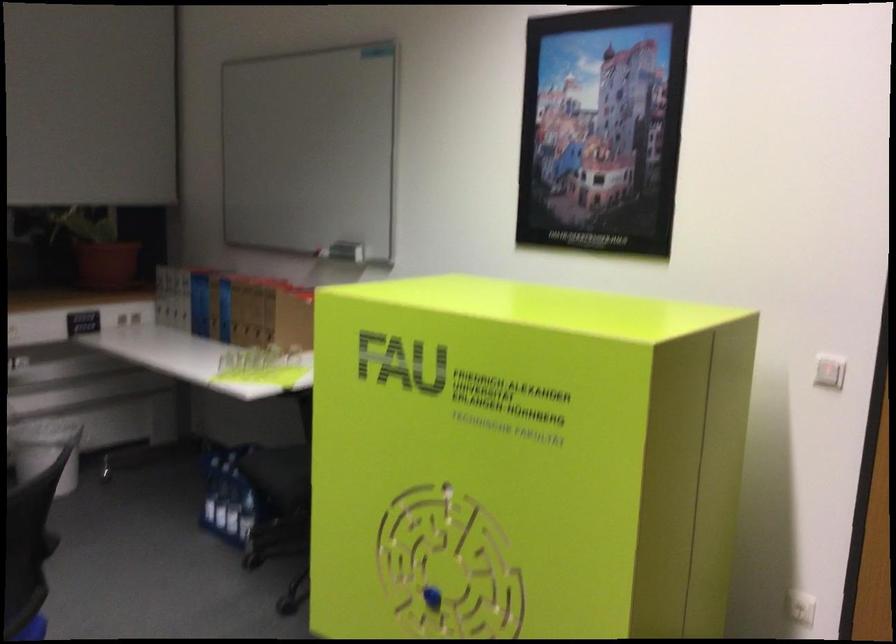
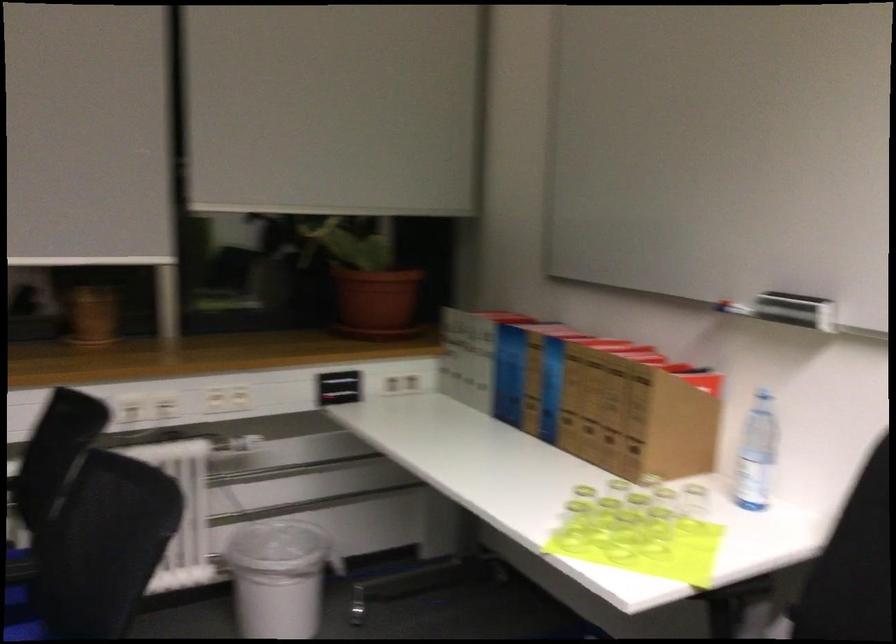
The point at (110,266) is marked in the first image. Where is the corresponding point in the second image?

(375, 303)